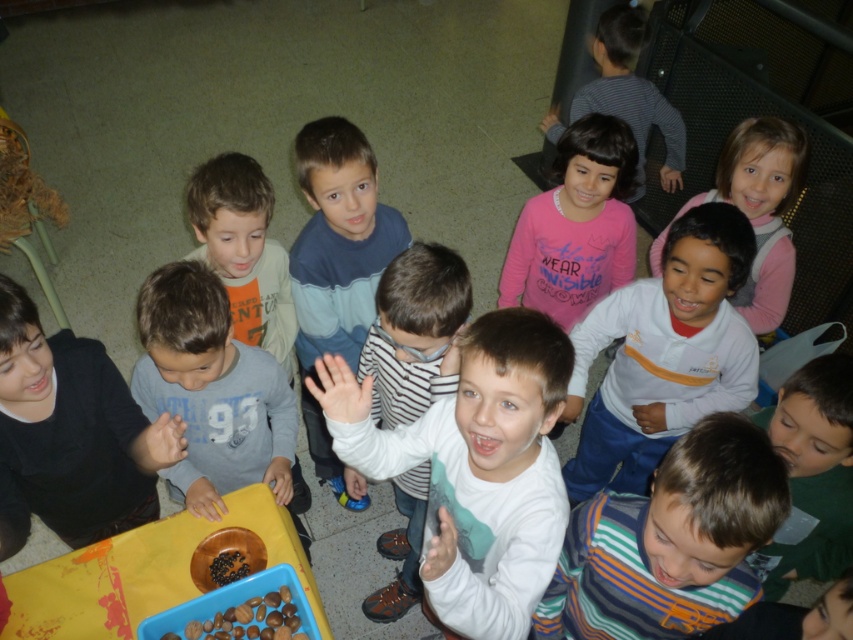
Does white cotton shirt at center appear on the left side of white striped shirt at center?

In fact, white cotton shirt at center is to the right of white striped shirt at center.

Who is shorter, white cotton shirt at center or white striped shirt at center?

white cotton shirt at center is shorter.

Between point (585, 371) and point (448, 250), which one is positioned behind?

Point (585, 371)

Where is `white cotton shirt at center`? white cotton shirt at center is located at coordinates (663, 353).

Who is more forward, (125, 484) or (822, 401)?

Point (822, 401) is more forward.

Where is `dark gray sweater at lower left`? dark gray sweater at lower left is located at coordinates (70, 435).

Describe the element at coordinates (70, 435) in the screenshot. I see `dark gray sweater at lower left` at that location.

The height and width of the screenshot is (640, 853). Find the location of `dark gray sweater at lower left`. dark gray sweater at lower left is located at coordinates (70, 435).

Does blue cotton shirt at center appear over pink fleece jacket at upper right?

No, blue cotton shirt at center is not above pink fleece jacket at upper right.

Is blue cotton shirt at center thinner than pink fleece jacket at upper right?

Yes.

Between point (334, 248) and point (738, 180), which one is positioned behind?

Positioned behind is point (738, 180).

Image resolution: width=853 pixels, height=640 pixels. In order to click on blue cotton shirt at center in this screenshot , I will do `click(337, 262)`.